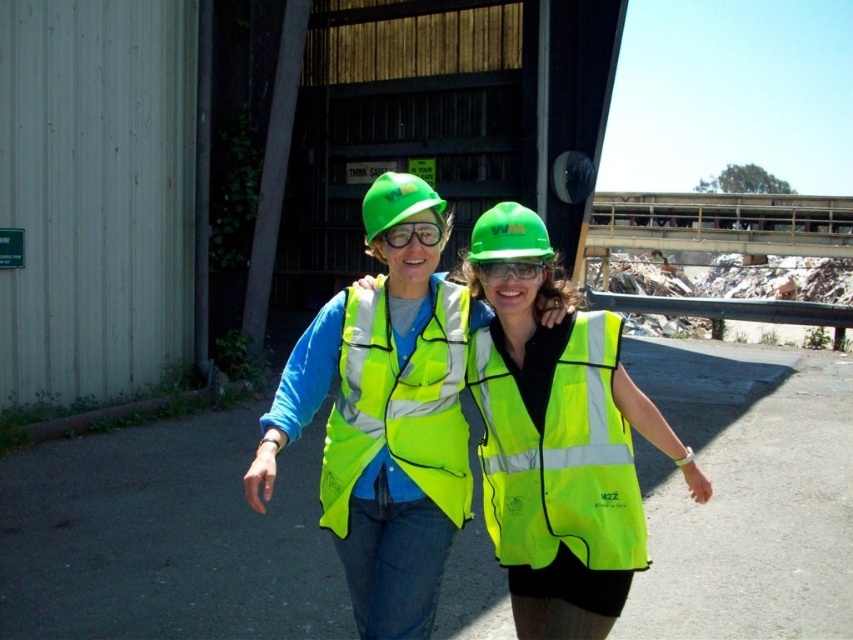
Question: Is neon yellow reflective safety vest at center positioned in front of matte green goggles at center?

Choices:
 (A) yes
 (B) no

Answer: (B)

Question: Which object is the farthest from the clear plastic goggles at center?

Choices:
 (A) high-visibility fabric safety vest at center
 (B) matte green goggles at center
 (C) neon yellow reflective safety vest at center

Answer: (A)

Question: Which point is closer to the camera?

Choices:
 (A) (424, 508)
 (B) (508, 248)
 (C) (566, 397)

Answer: (B)

Question: Is green matte hard hat at center to the left of matte green goggles at center from the viewer's perspective?

Choices:
 (A) yes
 (B) no

Answer: (B)

Question: Among these points, which one is farthest from the camera?

Choices:
 (A) (399, 356)
 (B) (439, 241)
 (C) (508, 269)

Answer: (A)

Question: Observing the image, what is the correct spatial positioning of green matte hard hat at center in reference to green hard hat at center?

Choices:
 (A) above
 (B) below

Answer: (B)